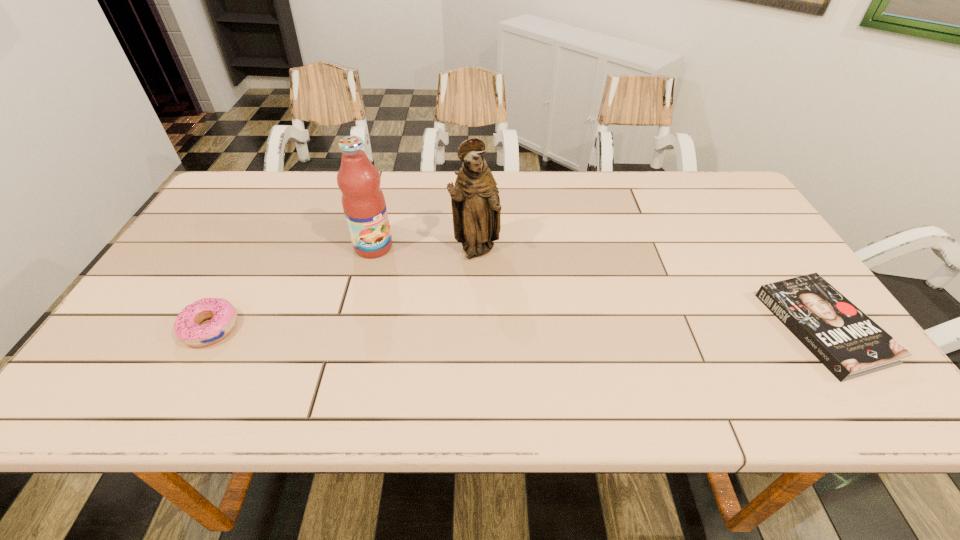
Identify the location of the leftmost object. (224, 316).

Locate an element on the screen. Image resolution: width=960 pixels, height=540 pixels. the third tallest object is located at coordinates (224, 316).

Where is `the rightmost object`? Image resolution: width=960 pixels, height=540 pixels. the rightmost object is located at coordinates (842, 337).

Locate an element on the screen. The height and width of the screenshot is (540, 960). the shortest object is located at coordinates (842, 337).

Identify the location of fruit juice. (363, 202).

I want to click on figurine, so click(x=476, y=210).

The width and height of the screenshot is (960, 540). Find the location of `vacant space located on the right of the third tallest object`. vacant space located on the right of the third tallest object is located at coordinates point(343,328).

Locate an element on the screen. The width and height of the screenshot is (960, 540). vacant space located on the back of the shortest object is located at coordinates (753, 226).

In order to click on free space located on the front label of the third object from right to left in this screenshot , I will do `click(438, 311)`.

Locate an element on the screen. The height and width of the screenshot is (540, 960). vacant space located on the front label of the third object from right to left is located at coordinates (408, 281).